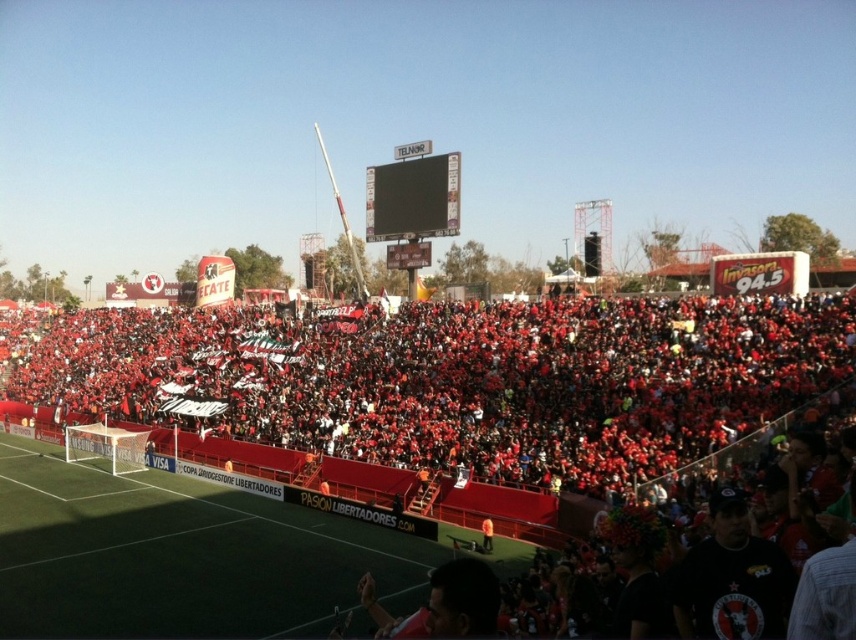
Does black glossy scoreboard at center appear under orange fabric person at lower center?

Actually, black glossy scoreboard at center is above orange fabric person at lower center.

The width and height of the screenshot is (856, 640). What do you see at coordinates (413, 198) in the screenshot? I see `black glossy scoreboard at center` at bounding box center [413, 198].

This screenshot has height=640, width=856. What are the coordinates of `black glossy scoreboard at center` in the screenshot? It's located at (413, 198).

Is point (80, 314) less distant than point (745, 577)?

No.

Measure the distance between point (266,378) and camera.

A distance of 260.02 feet exists between point (266,378) and camera.

The image size is (856, 640). Find the location of `red fabric crowd at center`. red fabric crowd at center is located at coordinates (462, 380).

Identify the location of red fabric crowd at center. The width and height of the screenshot is (856, 640). (462, 380).

Where is `red fabric crowd at center`? The height and width of the screenshot is (640, 856). red fabric crowd at center is located at coordinates (462, 380).